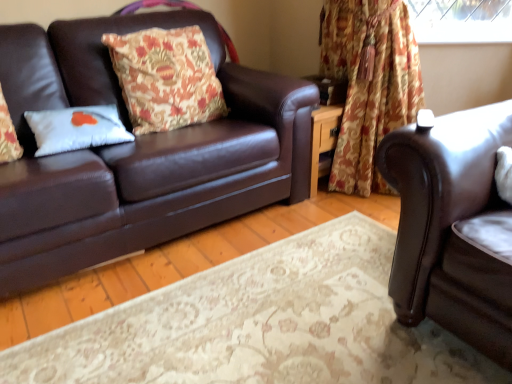
Measure the distance between point (x=228, y=210) and camera.

Point (x=228, y=210) is 6.51 feet away from camera.

Measure the distance between floral-patterned fabric pillow at left, placed as the 2th pillow when sorted from left to right, and camera.

A distance of 6.44 feet exists between floral-patterned fabric pillow at left, placed as the 2th pillow when sorted from left to right, and camera.

What do you see at coordinates (166, 78) in the screenshot?
I see `floral-patterned fabric pillow at left, placed as the 2th pillow when sorted from left to right` at bounding box center [166, 78].

Locate an element on the screen. brown leather couch at right, which is the first studio couch from right to left is located at coordinates (453, 227).

This screenshot has width=512, height=384. What do you see at coordinates (76, 128) in the screenshot?
I see `white matte pillow at left, the second pillow viewed from the right` at bounding box center [76, 128].

The height and width of the screenshot is (384, 512). I want to click on matte brown leather couch at left, which is counted as the first studio couch, starting from the left, so tap(136, 153).

From a real-world perspective, which object rests below the other?

In real-world perspective, brown leather couch at right, which is the first studio couch from right to left, is lower.

Can you confirm if matte brown leather couch at left, which is counted as the first studio couch, starting from the left, is positioned to the left of brown leather couch at right, the second studio couch positioned from the left?

Indeed, matte brown leather couch at left, which is counted as the first studio couch, starting from the left, is positioned on the left side of brown leather couch at right, the second studio couch positioned from the left.

From the picture: Is matte brown leather couch at left, which is the second studio couch in right-to-left order, facing towards brown leather couch at right, the second studio couch positioned from the left?

Yes, matte brown leather couch at left, which is the second studio couch in right-to-left order, faces towards brown leather couch at right, the second studio couch positioned from the left.

From the image's perspective, which one is positioned higher, floral-patterned fabric pillow at left, placed as the 2th pillow when sorted from left to right, or white matte pillow at left, the 1th pillow from the left?

floral-patterned fabric pillow at left, placed as the 2th pillow when sorted from left to right, appears higher in the image.

Is the surface of floral-patterned fabric pillow at left, the first pillow viewed from the right, in direct contact with white matte pillow at left, the 1th pillow from the left?

There is a gap between floral-patterned fabric pillow at left, the first pillow viewed from the right, and white matte pillow at left, the 1th pillow from the left.

Is floral-patterned fabric pillow at left, placed as the 2th pillow when sorted from left to right, positioned beyond the bounds of white matte pillow at left, the second pillow viewed from the right?

floral-patterned fabric pillow at left, placed as the 2th pillow when sorted from left to right, lies outside white matte pillow at left, the second pillow viewed from the right,'s area.

Is floral-patterned fabric pillow at left, placed as the 2th pillow when sorted from left to right, wider or thinner than white matte pillow at left, the second pillow viewed from the right?

floral-patterned fabric pillow at left, placed as the 2th pillow when sorted from left to right, is wider than white matte pillow at left, the second pillow viewed from the right.

From the image's perspective, between brown leather couch at right, the second studio couch positioned from the left, and floral fabric curtain at upper right, which one is located above?

floral fabric curtain at upper right.

Between brown leather couch at right, which is the first studio couch from right to left, and floral fabric curtain at upper right, which one appears on the right side from the viewer's perspective?

brown leather couch at right, which is the first studio couch from right to left, is more to the right.

Considering the relative sizes of brown leather couch at right, which is the first studio couch from right to left, and floral fabric curtain at upper right in the image provided, is brown leather couch at right, which is the first studio couch from right to left, taller than floral fabric curtain at upper right?

No, brown leather couch at right, which is the first studio couch from right to left, is not taller than floral fabric curtain at upper right.

Does brown leather couch at right, the second studio couch positioned from the left, have a smaller size compared to floral fabric curtain at upper right?

No, brown leather couch at right, the second studio couch positioned from the left, is not smaller than floral fabric curtain at upper right.

At what (x,y) coordinates should I click in order to perform the action: click on the 1st studio couch to the right of the white matte pillow at left, the 1th pillow from the left, counting from the anchor's position. Please return your answer as a coordinate pair (x, y). Looking at the image, I should click on (136, 153).

Is matte brown leather couch at left, which is counted as the first studio couch, starting from the left, situated inside white matte pillow at left, the second pillow viewed from the right, or outside?

matte brown leather couch at left, which is counted as the first studio couch, starting from the left, is not enclosed by white matte pillow at left, the second pillow viewed from the right.

Is point (163, 202) farther from viewer compared to point (62, 126)?

Yes.

From the image's perspective, is brown leather couch at right, the second studio couch positioned from the left, over floral-patterned fabric pillow at left, placed as the 2th pillow when sorted from left to right?

Actually, brown leather couch at right, the second studio couch positioned from the left, appears below floral-patterned fabric pillow at left, placed as the 2th pillow when sorted from left to right, in the image.

Between brown leather couch at right, which is the first studio couch from right to left, and floral-patterned fabric pillow at left, the first pillow viewed from the right, which one appears on the left side from the viewer's perspective?

floral-patterned fabric pillow at left, the first pillow viewed from the right.

Considering the relative sizes of brown leather couch at right, the second studio couch positioned from the left, and floral-patterned fabric pillow at left, placed as the 2th pillow when sorted from left to right, in the image provided, is brown leather couch at right, the second studio couch positioned from the left, bigger than floral-patterned fabric pillow at left, placed as the 2th pillow when sorted from left to right,?

Correct, brown leather couch at right, the second studio couch positioned from the left, is larger in size than floral-patterned fabric pillow at left, placed as the 2th pillow when sorted from left to right.

From the image's perspective, would you say floral fabric curtain at upper right is shown under matte brown leather couch at left, which is counted as the first studio couch, starting from the left?

Incorrect, from the image's perspective, floral fabric curtain at upper right is higher than matte brown leather couch at left, which is counted as the first studio couch, starting from the left.

How many degrees apart are the facing directions of floral fabric curtain at upper right and matte brown leather couch at left, which is the second studio couch in right-to-left order?

58.4 degrees separate the facing orientations of floral fabric curtain at upper right and matte brown leather couch at left, which is the second studio couch in right-to-left order.

Is floral fabric curtain at upper right taller than matte brown leather couch at left, which is counted as the first studio couch, starting from the left?

Indeed, floral fabric curtain at upper right has a greater height compared to matte brown leather couch at left, which is counted as the first studio couch, starting from the left.

Based on their sizes in the image, would you say floral fabric curtain at upper right is bigger or smaller than matte brown leather couch at left, which is counted as the first studio couch, starting from the left?

Clearly, floral fabric curtain at upper right is smaller in size than matte brown leather couch at left, which is counted as the first studio couch, starting from the left.

Is brown leather couch at right, the second studio couch positioned from the left, in contact with white matte pillow at left, the 1th pillow from the left?

No, brown leather couch at right, the second studio couch positioned from the left, is not touching white matte pillow at left, the 1th pillow from the left.

Which of these two, brown leather couch at right, which is the first studio couch from right to left, or white matte pillow at left, the 1th pillow from the left, stands taller?

With more height is brown leather couch at right, which is the first studio couch from right to left.

From a real-world perspective, is brown leather couch at right, which is the first studio couch from right to left, above or below white matte pillow at left, the 1th pillow from the left?

Clearly, from a real-world perspective, brown leather couch at right, which is the first studio couch from right to left, is below white matte pillow at left, the 1th pillow from the left.

Do you think brown leather couch at right, the second studio couch positioned from the left, is within white matte pillow at left, the 1th pillow from the left, or outside of it?

brown leather couch at right, the second studio couch positioned from the left, is spatially situated outside white matte pillow at left, the 1th pillow from the left.

This screenshot has height=384, width=512. I want to click on studio couch below the matte brown leather couch at left, which is counted as the first studio couch, starting from the left (from a real-world perspective), so click(x=453, y=227).

Where is `pillow behind the white matte pillow at left, the 1th pillow from the left`? The image size is (512, 384). pillow behind the white matte pillow at left, the 1th pillow from the left is located at coordinates (166, 78).

Looking at the image, which one is located further to matte brown leather couch at left, which is the second studio couch in right-to-left order, white matte pillow at left, the 1th pillow from the left, or floral fabric curtain at upper right?

The object further to matte brown leather couch at left, which is the second studio couch in right-to-left order, is floral fabric curtain at upper right.

From the image, which object appears to be farther from matte brown leather couch at left, which is the second studio couch in right-to-left order, brown leather couch at right, the second studio couch positioned from the left, or floral-patterned fabric pillow at left, placed as the 2th pillow when sorted from left to right?

brown leather couch at right, the second studio couch positioned from the left, is further to matte brown leather couch at left, which is the second studio couch in right-to-left order.

Considering their positions, is floral fabric curtain at upper right positioned further to brown leather couch at right, the second studio couch positioned from the left, than white matte pillow at left, the 1th pillow from the left?

Among the two, white matte pillow at left, the 1th pillow from the left, is located further to brown leather couch at right, the second studio couch positioned from the left.

From the image, which object appears to be nearer to white matte pillow at left, the 1th pillow from the left, floral fabric curtain at upper right or floral-patterned fabric pillow at left, the first pillow viewed from the right?

floral-patterned fabric pillow at left, the first pillow viewed from the right.

Estimate the real-world distances between objects in this image. Which object is further from floral-patterned fabric pillow at left, placed as the 2th pillow when sorted from left to right, white matte pillow at left, the 1th pillow from the left, or brown leather couch at right, the second studio couch positioned from the left?

brown leather couch at right, the second studio couch positioned from the left, lies further to floral-patterned fabric pillow at left, placed as the 2th pillow when sorted from left to right, than the other object.

Based on their spatial positions, is brown leather couch at right, which is the first studio couch from right to left, or floral fabric curtain at upper right closer to white matte pillow at left, the 1th pillow from the left?

Based on the image, brown leather couch at right, which is the first studio couch from right to left, appears to be nearer to white matte pillow at left, the 1th pillow from the left.

Which object lies nearer to the anchor point brown leather couch at right, which is the first studio couch from right to left, matte brown leather couch at left, which is counted as the first studio couch, starting from the left, or floral-patterned fabric pillow at left, the first pillow viewed from the right?

The object closer to brown leather couch at right, which is the first studio couch from right to left, is matte brown leather couch at left, which is counted as the first studio couch, starting from the left.

Looking at the image, which one is located closer to floral-patterned fabric pillow at left, the first pillow viewed from the right, white matte pillow at left, the second pillow viewed from the right, or floral fabric curtain at upper right?

white matte pillow at left, the second pillow viewed from the right, is closer to floral-patterned fabric pillow at left, the first pillow viewed from the right.

Find the location of a particular element. pillow located between matte brown leather couch at left, which is the second studio couch in right-to-left order, and floral fabric curtain at upper right in the left-right direction is located at coordinates (166, 78).

In order to click on curtain between white matte pillow at left, the second pillow viewed from the right, and brown leather couch at right, which is the first studio couch from right to left, from left to right in this screenshot , I will do `click(369, 83)`.

The width and height of the screenshot is (512, 384). I want to click on studio couch located between white matte pillow at left, the 1th pillow from the left, and brown leather couch at right, the second studio couch positioned from the left, in the left-right direction, so click(136, 153).

Where is `pillow between white matte pillow at left, the second pillow viewed from the right, and brown leather couch at right, which is the first studio couch from right to left, from left to right`? This screenshot has height=384, width=512. pillow between white matte pillow at left, the second pillow viewed from the right, and brown leather couch at right, which is the first studio couch from right to left, from left to right is located at coordinates (166, 78).